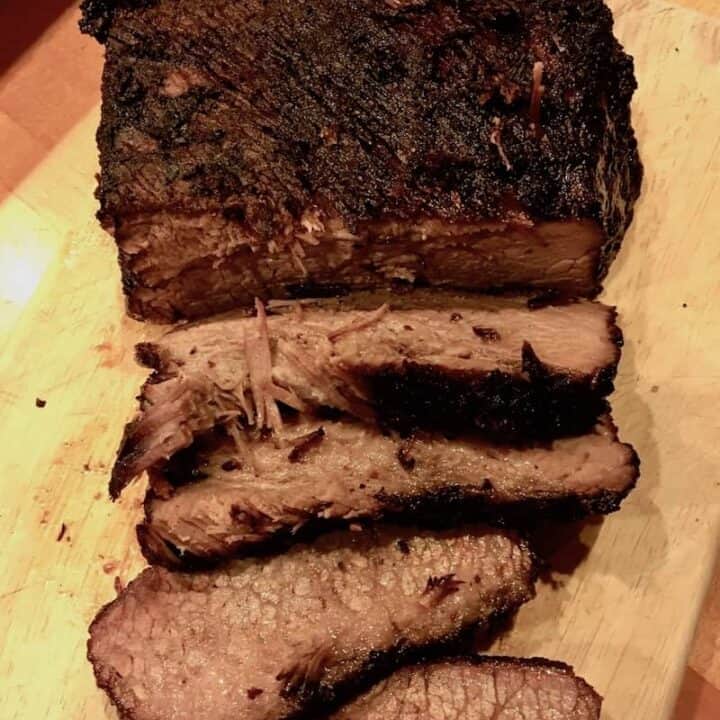
You are a GUI agent. You are given a task and a screenshot of the screen. Output one action in this format:
    pyautogui.click(x=<x>, y=<y>)
    Task: Click on the cutting board
    
    Given the screenshot: What is the action you would take?
    pyautogui.click(x=50, y=348)